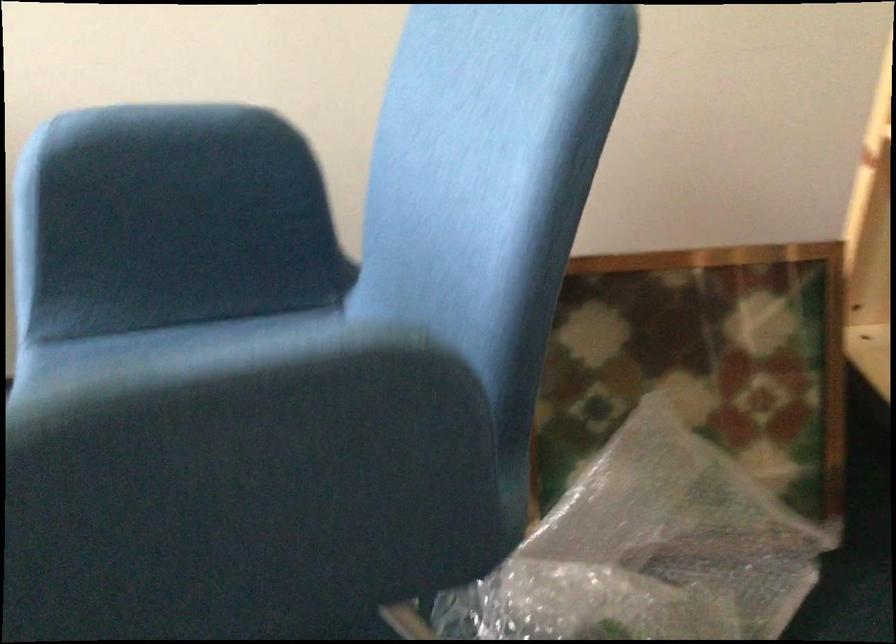
Image resolution: width=896 pixels, height=644 pixels. In order to click on blue chair armrest in this screenshot , I will do `click(159, 142)`.